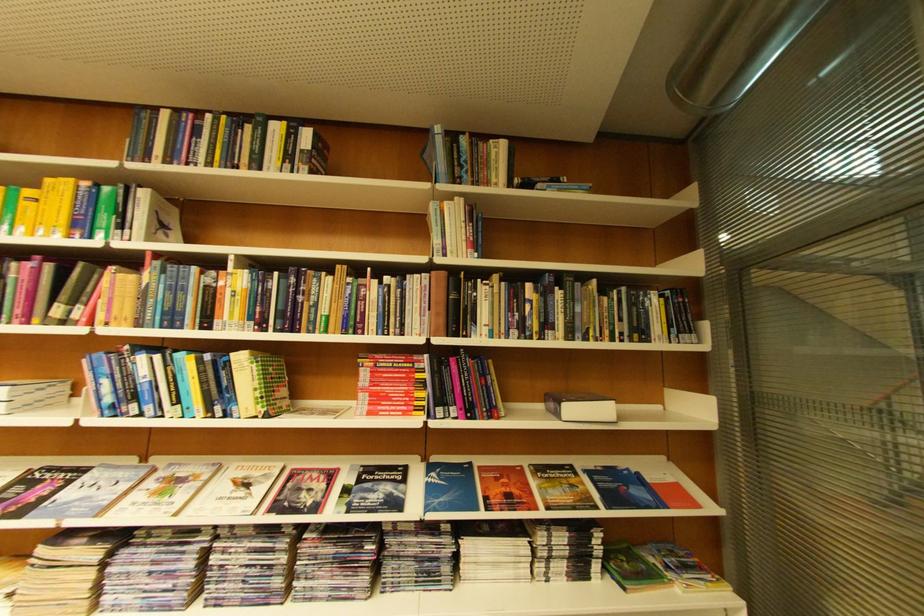
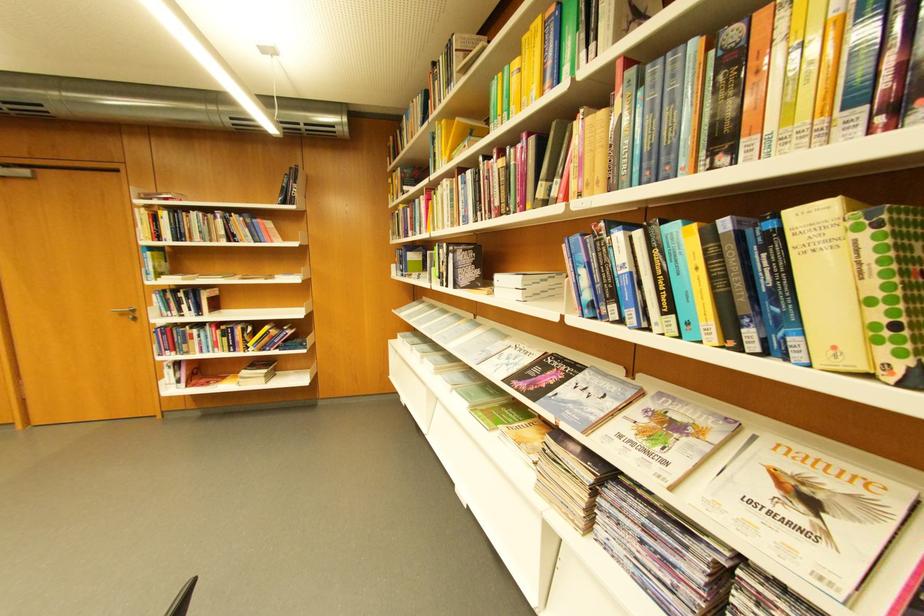
Find the pixel in the second image that matches the point at 38,407 in the first image.

(544, 296)